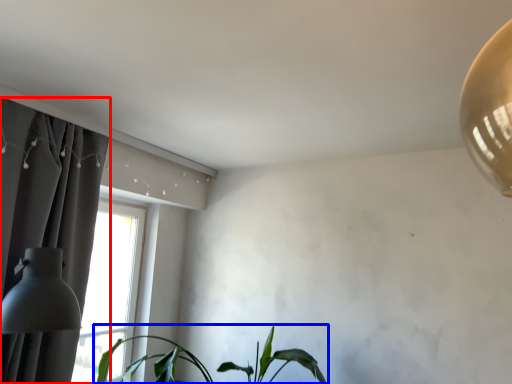
Question: Which point is closer to the camera, curtain (highlighted by a red box) or houseplant (highlighted by a blue box)?

Choices:
 (A) curtain
 (B) houseplant

Answer: (A)